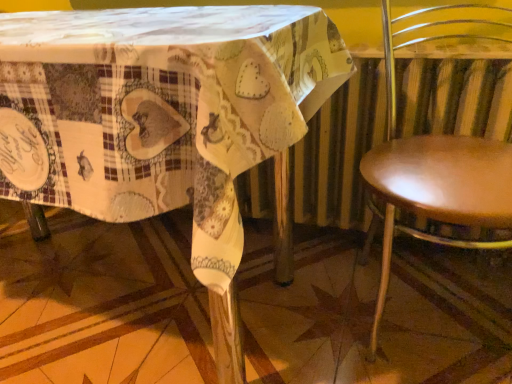
This screenshot has width=512, height=384. In order to click on vacant space underneath printed fabric table at center (from a real-world perspective) in this screenshot , I will do click(114, 294).